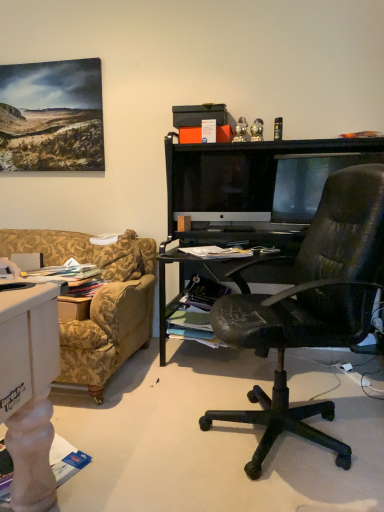
Question: Looking at their shapes, would you say satin black monitor at center is wider or thinner than matte black monitor at right?

Choices:
 (A) wide
 (B) thin

Answer: (A)

Question: Is satin black monitor at center bigger or smaller than matte black monitor at right?

Choices:
 (A) big
 (B) small

Answer: (A)

Question: Considering the positions of point (172, 202) and point (273, 200), is point (172, 202) closer or farther from the camera than point (273, 200)?

Choices:
 (A) farther
 (B) closer

Answer: (B)

Question: Considering the positions of matte black monitor at right and satin black monitor at center in the image, is matte black monitor at right wider or thinner than satin black monitor at center?

Choices:
 (A) wide
 (B) thin

Answer: (B)

Question: From a real-world perspective, is matte black monitor at right above or below satin black monitor at center?

Choices:
 (A) above
 (B) below

Answer: (B)

Question: Is point (311, 195) positioned closer to the camera than point (193, 192)?

Choices:
 (A) farther
 (B) closer

Answer: (B)

Question: Is matte black monitor at right in front of or behind satin black monitor at center in the image?

Choices:
 (A) front
 (B) behind

Answer: (A)